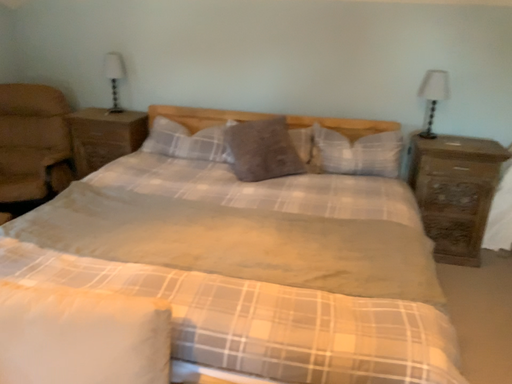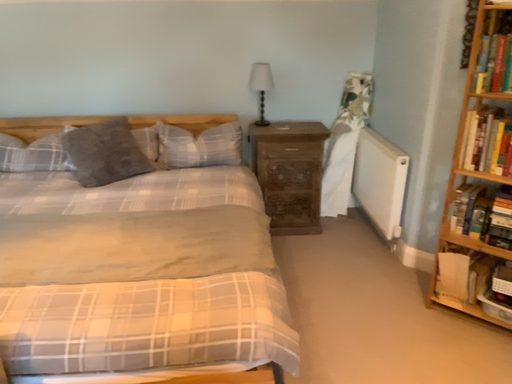
Question: How did the camera likely rotate when shooting the video?

Choices:
 (A) rotated left
 (B) rotated right

Answer: (B)